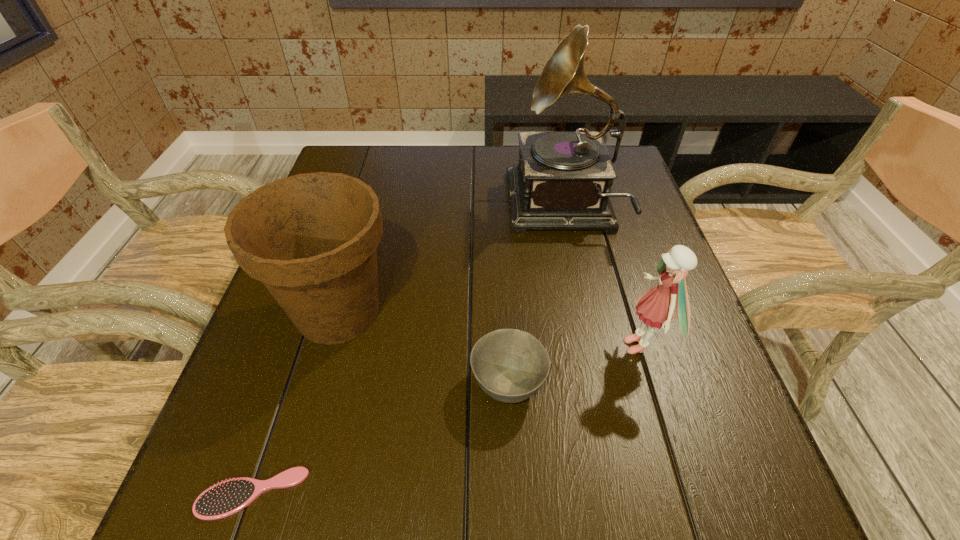
Find the location of a particular element. The width and height of the screenshot is (960, 540). record player is located at coordinates (563, 181).

This screenshot has width=960, height=540. What are the coordinates of `the tallest object` in the screenshot? It's located at (563, 181).

Image resolution: width=960 pixels, height=540 pixels. I want to click on flowerpot, so click(311, 239).

Where is `doll`? doll is located at coordinates (657, 306).

Locate an element on the screen. The image size is (960, 540). bowl is located at coordinates (510, 365).

I want to click on hairbrush, so click(228, 497).

Find the location of a particular element. Image resolution: width=960 pixels, height=540 pixels. the shortest object is located at coordinates (228, 497).

The image size is (960, 540). Identify the location of blank area located on the horn of the record player. (432, 208).

The height and width of the screenshot is (540, 960). I want to click on vacant area situated on the horn of the record player, so click(x=378, y=208).

Identify the location of free space located 0.380m on the horn of the record player. (363, 208).